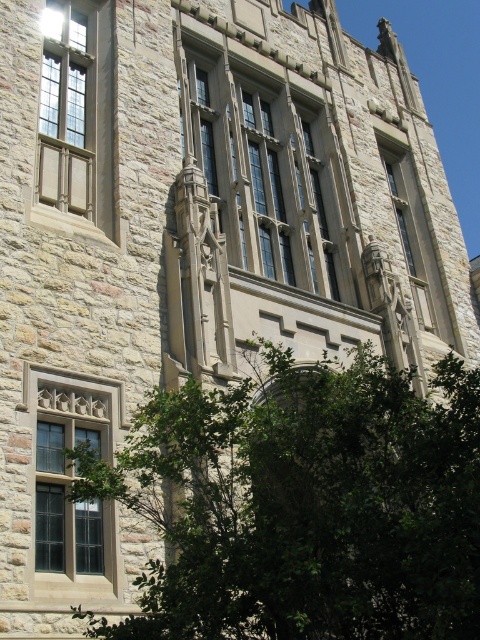
Question: Is green leafy tree at lower left further to the viewer compared to dark gray stone window at lower left?

Choices:
 (A) yes
 (B) no

Answer: (B)

Question: Based on their relative distances, which object is farther from the green leafy tree at lower left?

Choices:
 (A) smooth stone window at upper center
 (B) clear glass window at upper left

Answer: (A)

Question: Which point is closer to the camera?

Choices:
 (A) (243, 205)
 (B) (66, 184)

Answer: (B)

Question: Which object is positioned farthest from the smooth stone window at upper center?

Choices:
 (A) green leafy tree at lower left
 (B) stone textured window at center

Answer: (A)

Question: Does stone textured window at center have a larger size compared to clear glass window at upper left?

Choices:
 (A) no
 (B) yes

Answer: (B)

Question: Can you confirm if dark gray stone window at lower left is positioned to the left of smooth stone window at upper center?

Choices:
 (A) yes
 (B) no

Answer: (A)